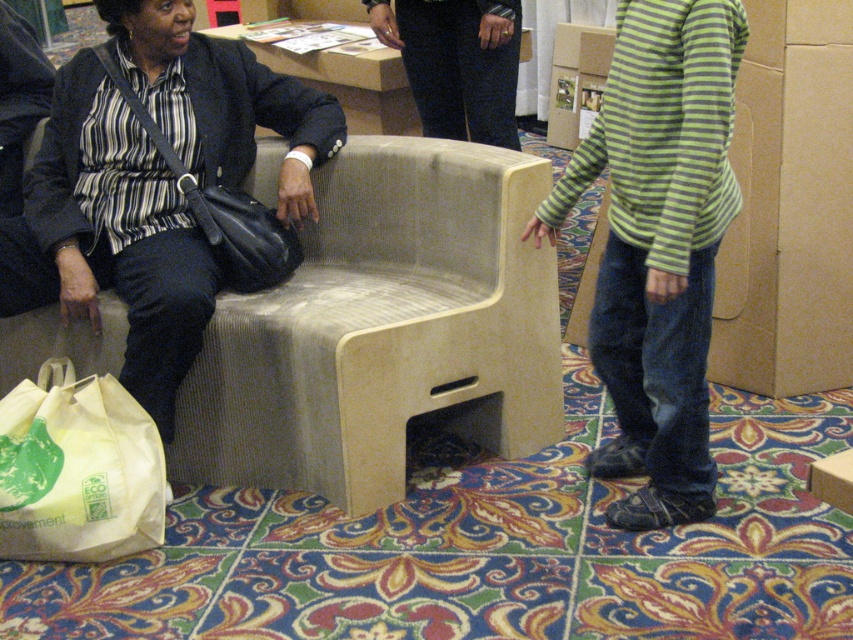
Looking at this image, can you confirm if beige fabric armchair at center is positioned below matte black purse at left?

Yes, beige fabric armchair at center is below matte black purse at left.

Is point (177, 419) more distant than point (234, 104)?

No, (177, 419) is in front of (234, 104).

Where is `beige fabric armchair at center`? This screenshot has width=853, height=640. beige fabric armchair at center is located at coordinates (383, 330).

Can you confirm if beige fabric armchair at center is positioned to the right of green striped sweater at center?

Incorrect, beige fabric armchair at center is not on the right side of green striped sweater at center.

Between point (334, 193) and point (718, 218), which one is positioned in front?

Positioned in front is point (718, 218).

What do you see at coordinates (383, 330) in the screenshot? I see `beige fabric armchair at center` at bounding box center [383, 330].

This screenshot has height=640, width=853. Find the location of `beige fabric armchair at center`. beige fabric armchair at center is located at coordinates (383, 330).

Does beige fabric armchair at center have a larger size compared to white paper bag at lower left?

Correct, beige fabric armchair at center is larger in size than white paper bag at lower left.

Which of these two, beige fabric armchair at center or white paper bag at lower left, stands taller?

beige fabric armchair at center

I want to click on beige fabric armchair at center, so click(383, 330).

Where is `beige fabric armchair at center`? This screenshot has width=853, height=640. beige fabric armchair at center is located at coordinates (383, 330).